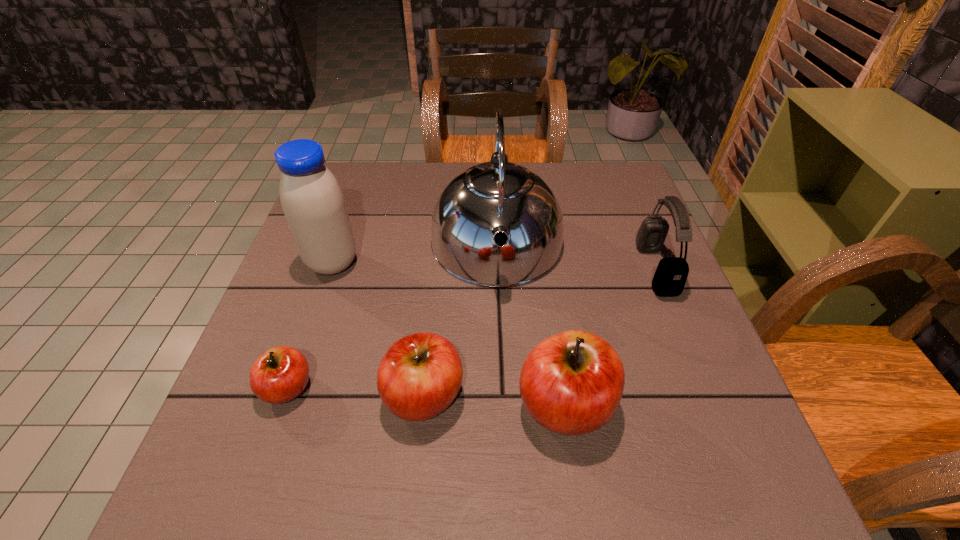
The width and height of the screenshot is (960, 540). I want to click on free space located 0.160m on the back of the rightmost apple, so click(550, 304).

This screenshot has width=960, height=540. Identify the location of vacant area situated from the spout of the kettle. (504, 413).

Image resolution: width=960 pixels, height=540 pixels. Find the location of `vacant space located on the headband of the headset`. vacant space located on the headband of the headset is located at coordinates (613, 269).

Identify the location of vacant space situated on the headband of the headset. (498, 269).

Find the location of `vacant space positioned 0.270m on the headband of the headset`. vacant space positioned 0.270m on the headband of the headset is located at coordinates (528, 269).

I want to click on free space located 0.080m on the back of the soya milk, so click(x=346, y=226).

Identify the location of object located at the far edge. The height and width of the screenshot is (540, 960). (497, 196).

This screenshot has height=540, width=960. Identify the location of apple present at the left edge. tap(281, 374).

I want to click on soya milk that is at the left edge, so click(312, 201).

The width and height of the screenshot is (960, 540). What are the coordinates of `object situated at the right edge` in the screenshot? It's located at (671, 274).